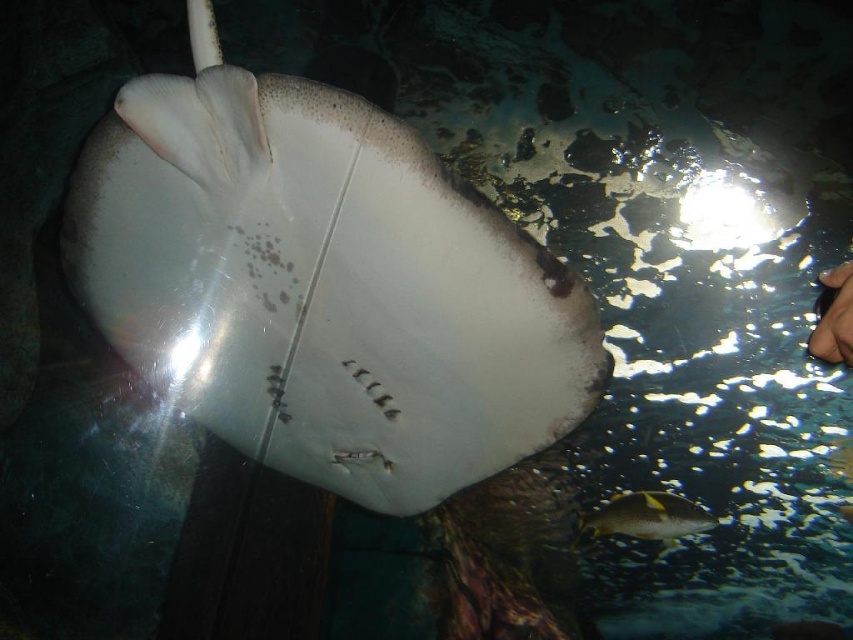
Question: Is white smooth stingray at center further to the viewer compared to smooth skin hand at upper right?

Choices:
 (A) yes
 (B) no

Answer: (A)

Question: Which object is the closest to the white smooth stingray at center?

Choices:
 (A) yellow-orange textured fish at lower right
 (B) smooth skin hand at upper right

Answer: (B)

Question: Which object is the farthest from the smooth skin hand at upper right?

Choices:
 (A) yellow-orange textured fish at lower right
 (B) white smooth stingray at center

Answer: (A)

Question: Which point is farther from the camera taking this photo?

Choices:
 (A) (235, 90)
 (B) (654, 520)

Answer: (B)

Question: Where is white smooth stingray at center located in relation to smooth skin hand at upper right in the image?

Choices:
 (A) left
 (B) right

Answer: (A)

Question: Can you confirm if yellow-orange textured fish at lower right is positioned above smooth skin hand at upper right?

Choices:
 (A) no
 (B) yes

Answer: (A)